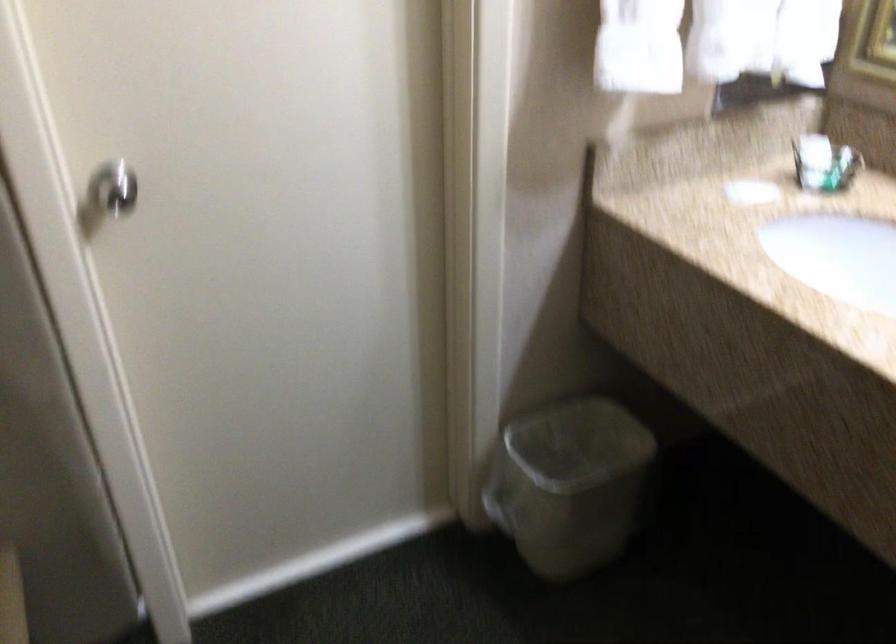
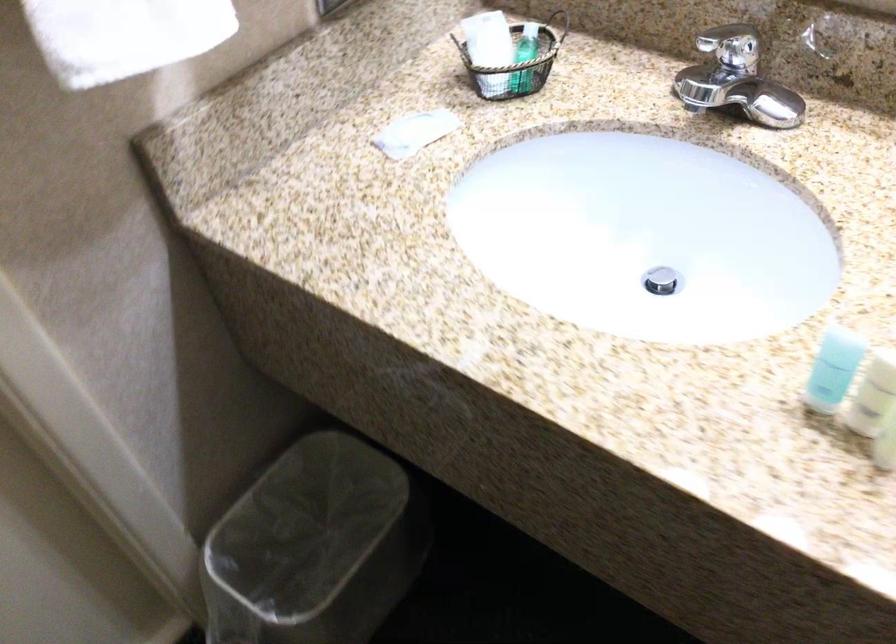
Locate, in the second image, the point that corresponds to (x=630, y=73) in the first image.

(124, 35)